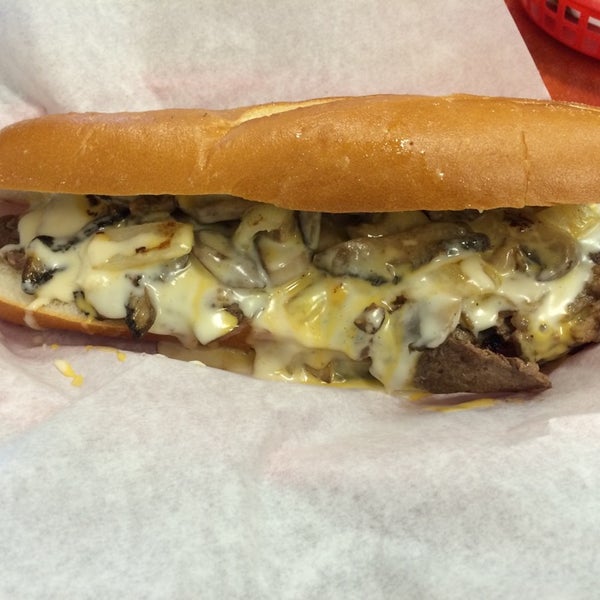
Identify the location of table. The width and height of the screenshot is (600, 600). (575, 72).